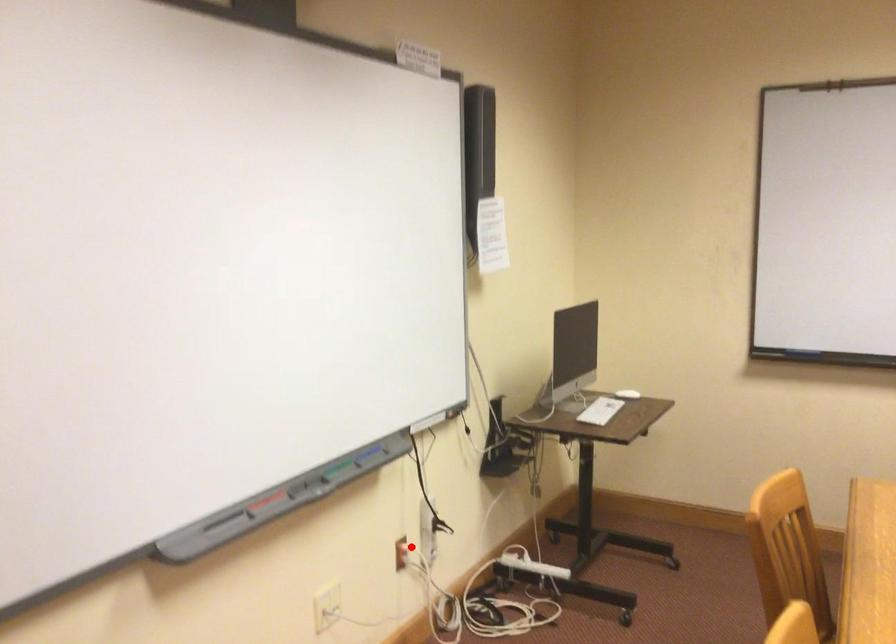
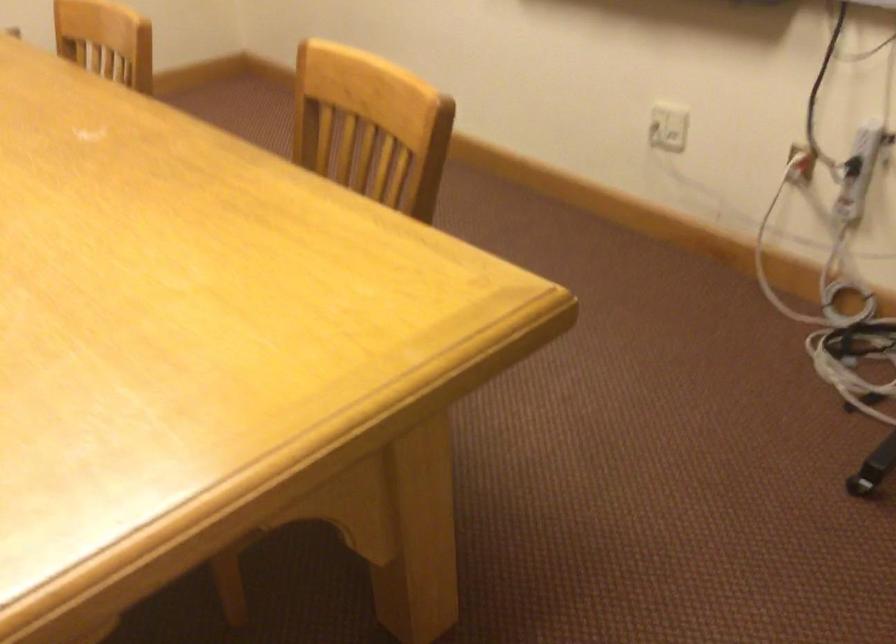
Question: A red point is marked in image1. In image2, is the corresponding 3D point closer to the camera or farther? Reply with the corresponding letter.

Choices:
 (A) The corresponding 3D point is closer.
 (B) The corresponding 3D point is farther.

Answer: (A)